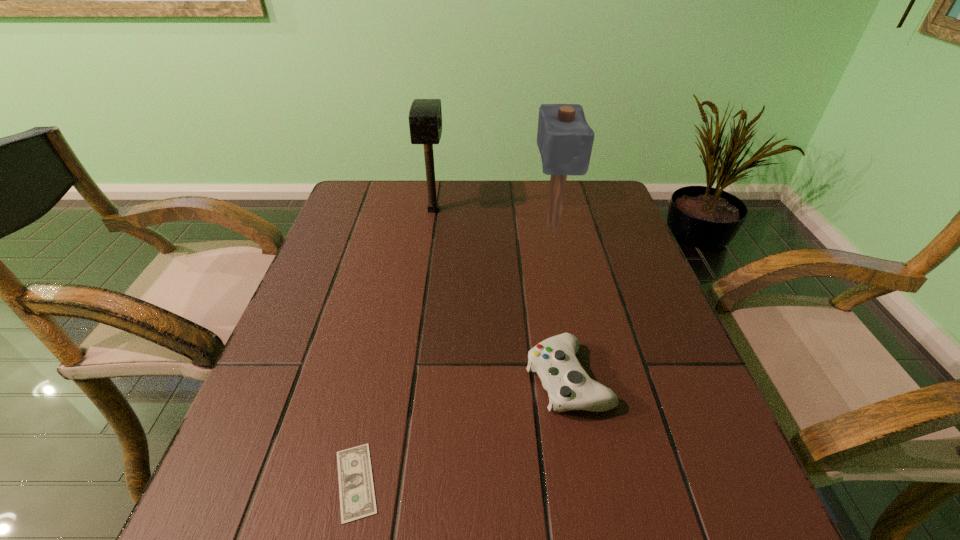
This screenshot has width=960, height=540. In order to click on free point between the right mallet and the shortest object in this screenshot , I will do `click(454, 354)`.

At what (x,y) coordinates should I click in order to perform the action: click on free spot between the shortest object and the right mallet. Please return your answer as a coordinate pair (x, y). This screenshot has width=960, height=540. Looking at the image, I should click on (454, 354).

At what (x,y) coordinates should I click in order to perform the action: click on free space between the right mallet and the money. Please return your answer as a coordinate pair (x, y). This screenshot has width=960, height=540. Looking at the image, I should click on (454, 354).

Identify the location of vacant space that is in between the right mallet and the money. (454, 354).

Where is `free space between the left mallet and the third tallest object`? This screenshot has height=540, width=960. free space between the left mallet and the third tallest object is located at coordinates (500, 295).

I want to click on empty space between the control and the shortest object, so click(462, 430).

This screenshot has height=540, width=960. I want to click on vacant region between the third farthest object and the money, so click(x=462, y=430).

At what (x,y) coordinates should I click in order to perform the action: click on empty space that is in between the left mallet and the nearest object. Please return your answer as a coordinate pair (x, y). Looking at the image, I should click on (395, 346).

Find the location of a particular element. The image size is (960, 540). object that is the third nearest to the third farthest object is located at coordinates (425, 116).

Select which object is the closest to the shortest object. Please provide its 2D coordinates. Your answer should be formatted as a tuple, i.e. [(x, y)], where the tuple contains the x and y coordinates of a point satisfying the conditions above.

[(569, 387)]